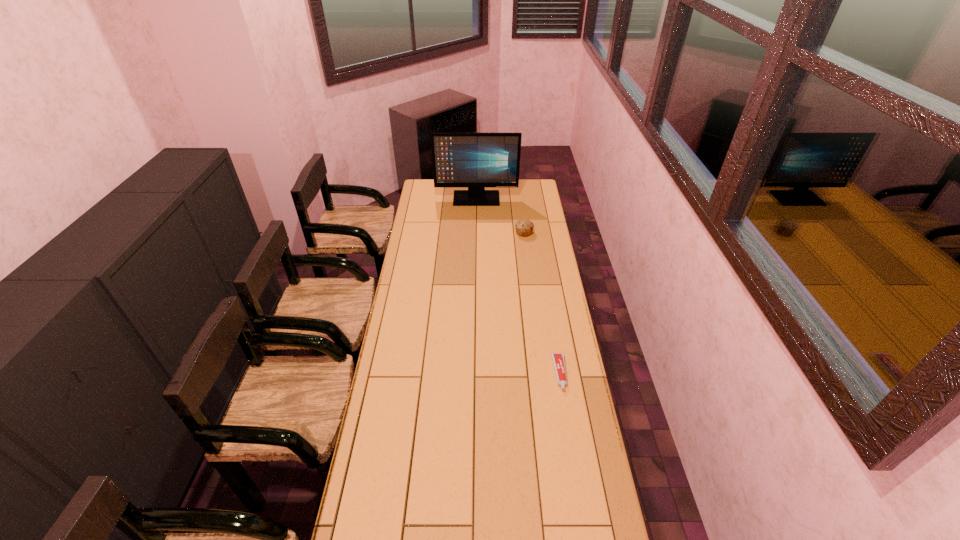
Locate an element on the screen. Image resolution: width=960 pixels, height=540 pixels. vacant area that lies between the nearest object and the tallest object is located at coordinates (518, 286).

Where is `free space between the shortest object and the tallest object`? The height and width of the screenshot is (540, 960). free space between the shortest object and the tallest object is located at coordinates (518, 286).

Locate an element on the screen. The width and height of the screenshot is (960, 540). vacant space that's between the nearest object and the tallest object is located at coordinates [x=518, y=286].

This screenshot has width=960, height=540. Find the location of `empty location between the shortest object and the second tallest object`. empty location between the shortest object and the second tallest object is located at coordinates (542, 303).

You are a GUI agent. You are given a task and a screenshot of the screen. Output one action in this format:
    pyautogui.click(x=<x>, y=<y>)
    Task: Click on the empty location between the toothpaste and the second farthest object
    Image resolution: width=960 pixels, height=540 pixels.
    Given the screenshot: What is the action you would take?
    coord(542,303)

Point out which object is positioned as the second nearest to the monitor. Please provide its 2D coordinates. Your answer should be formatted as a tuple, i.e. [(x, y)], where the tuple contains the x and y coordinates of a point satisfying the conditions above.

[(558, 359)]

Locate which object is the closest to the muffin. Please provide its 2D coordinates. Your answer should be formatted as a tuple, i.e. [(x, y)], where the tuple contains the x and y coordinates of a point satisfying the conditions above.

[(475, 160)]

This screenshot has height=540, width=960. I want to click on vacant space that satisfies the following two spatial constraints: 1. on the screen side of the muffin; 2. on the right side of the tallest object, so click(x=476, y=233).